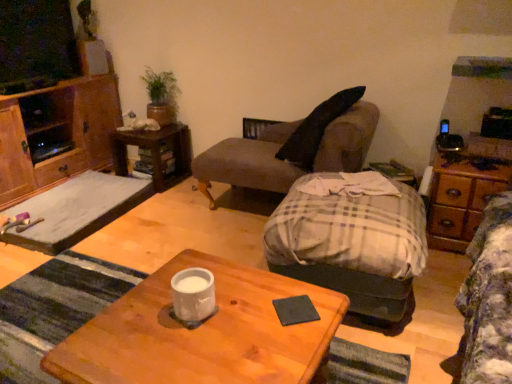
Locate an element on the screen. The width and height of the screenshot is (512, 384). vacant space in front of brown wood side table at upper left, the first side table in the left-to-right sequence is located at coordinates (170, 201).